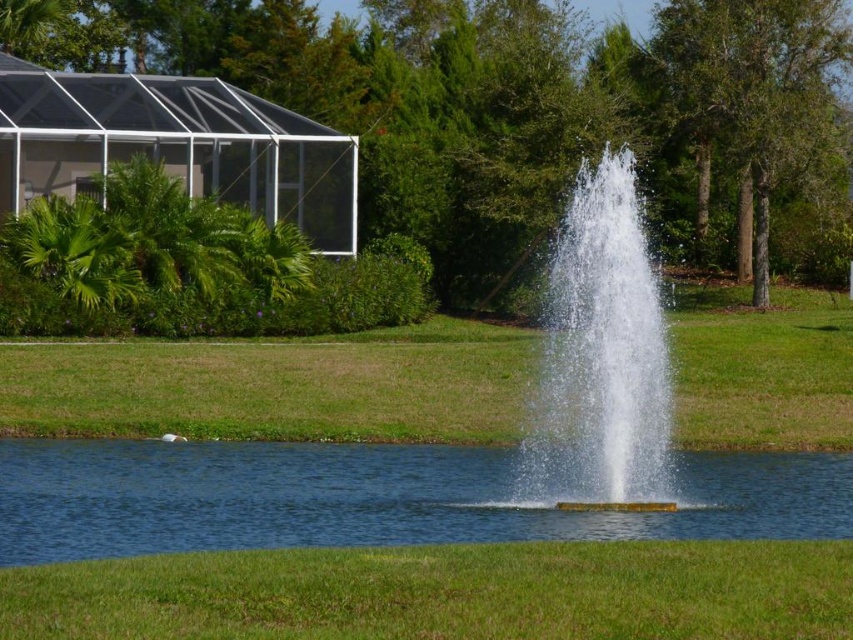
Question: Does clear blue water at center have a greater width compared to clear water fountain at center?

Choices:
 (A) yes
 (B) no

Answer: (A)

Question: Can you confirm if clear blue water at center is smaller than clear water fountain at center?

Choices:
 (A) no
 (B) yes

Answer: (B)

Question: Among these points, which one is farthest from the camera?

Choices:
 (A) (642, 273)
 (B) (33, 476)

Answer: (B)

Question: Which point is closer to the camera taking this photo?

Choices:
 (A) (351, 516)
 (B) (550, 268)

Answer: (A)

Question: Does clear blue water at center come in front of clear water fountain at center?

Choices:
 (A) yes
 (B) no

Answer: (A)